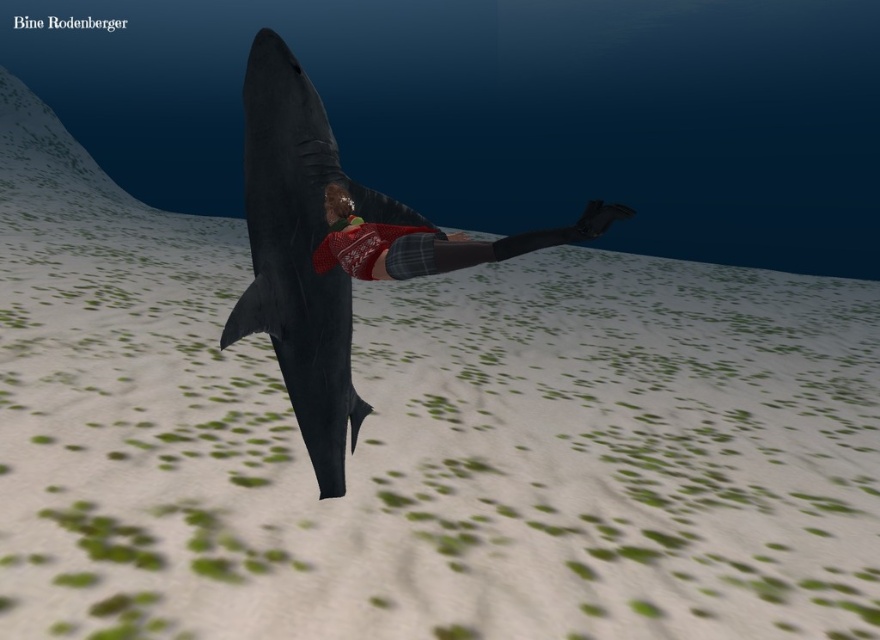
Question: Which object is closer to the camera taking this photo?

Choices:
 (A) sweater at center
 (B) shiny black shark at center

Answer: (A)

Question: Is shiny black shark at center wider than sweater at center?

Choices:
 (A) yes
 (B) no

Answer: (B)

Question: From the image, what is the correct spatial relationship of shiny black shark at center in relation to sweater at center?

Choices:
 (A) below
 (B) above

Answer: (A)

Question: Is shiny black shark at center further to camera compared to sweater at center?

Choices:
 (A) no
 (B) yes

Answer: (B)

Question: Which object appears closest to the camera in this image?

Choices:
 (A) shiny black shark at center
 (B) sweater at center

Answer: (B)